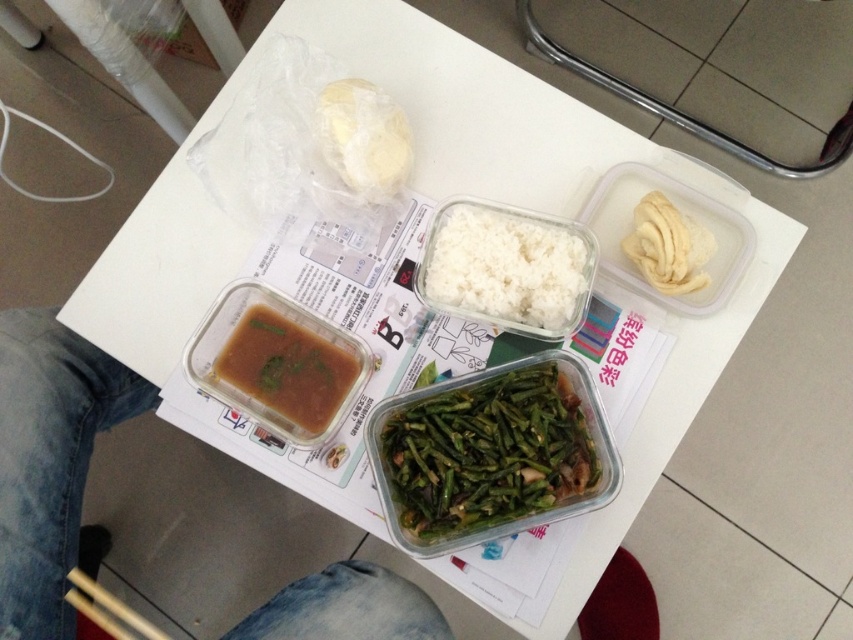
You are a food delivery person who needs to stack these containers for delivery. The white matte doughnut at upper center is on top of the green glossy string beans at center. Which container should you place on the bottom to ensure the doughnut stays on top?

You should place the container with the green glossy string beans at center on the bottom since the white matte doughnut at upper center is above it, so stacking the string beans container first will keep the doughnut container on top.

You are a delivery person who needs to pick up a package from a table. The package is at point (119,413) and there is an obstacle at point (567,396). Can you reach the package without moving the obstacle?

Point (119,413) is behind point (567,396), so you cannot reach the package without moving the obstacle at point (567,396).

You are a diner at a restaurant and want to reach for the wooden chopsticks at lower left and the white crinkled chips at upper right. Which object is located to the right side of the other?

The white crinkled chips at upper right is to the right of wooden chopsticks at lower left.